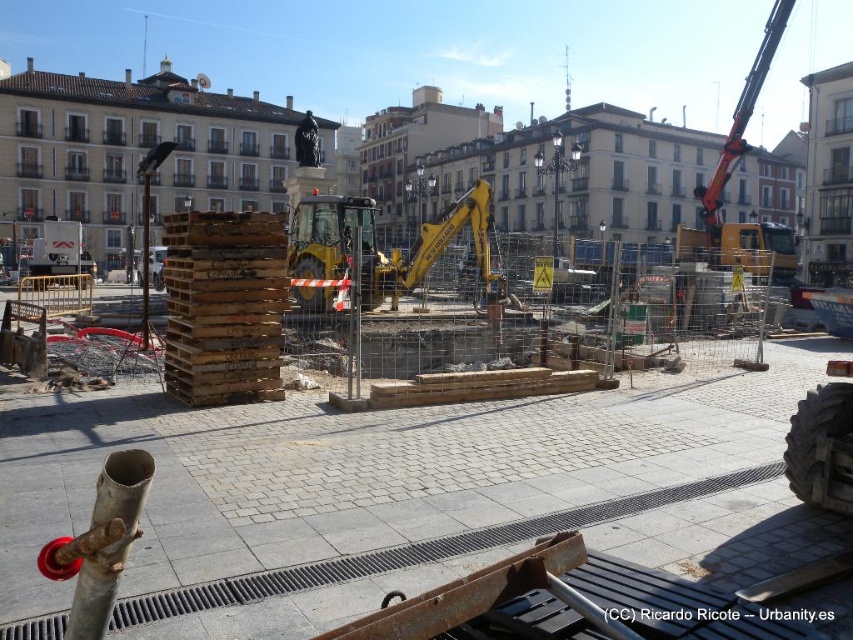
Question: Can you confirm if wooden pallets at center is wider than blacktexturedwebsite at center?

Choices:
 (A) no
 (B) yes

Answer: (B)

Question: Which object is farther from the camera taking this photo?

Choices:
 (A) bronze statue at center
 (B) yellow metallic excavator at upper right
 (C) wooden pallets at center

Answer: (A)

Question: Is yellow metallic excavator at upper right smaller than blacktexturedwebsite at center?

Choices:
 (A) yes
 (B) no

Answer: (B)

Question: Which object is the closest to the yellow metallic excavator at upper right?

Choices:
 (A) bronze statue at center
 (B) blacktexturedwebsite at center
 (C) wooden pallets at center
 (D) yellow metallic excavator at center

Answer: (D)

Question: Which is farther from the yellow metallic excavator at upper right?

Choices:
 (A) wooden pallets at center
 (B) blacktexturedwebsite at center
 (C) yellow metallic excavator at center

Answer: (B)

Question: Does wooden pallets at center have a larger size compared to blacktexturedwebsite at center?

Choices:
 (A) no
 (B) yes

Answer: (B)